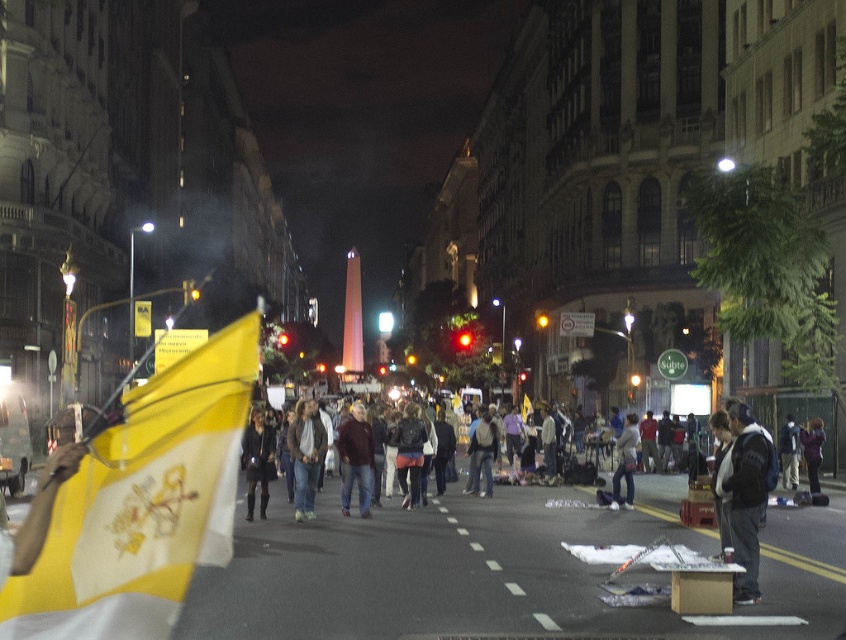
Question: Does dark blue jeans at center have a larger size compared to dark blue jacket at center?

Choices:
 (A) yes
 (B) no

Answer: (A)

Question: Does maroon sweater at center appear on the left side of dark purple jacket at center?

Choices:
 (A) no
 (B) yes

Answer: (B)

Question: Which of these objects is positioned closest to the dark blue jeans at center?

Choices:
 (A) light brown leather jacket at center
 (B) denim jacket at center
 (C) leather jacket at center
 (D) dark purple jacket at center

Answer: (C)

Question: Which of the following is the farthest from the observer?

Choices:
 (A) (39, 632)
 (B) (360, 449)
 (C) (630, 477)

Answer: (C)

Question: From the image, what is the correct spatial relationship of leather jacket at center in relation to dark purple jacket at center?

Choices:
 (A) below
 (B) above

Answer: (A)

Question: Which of these objects is positioned closest to the dark blue jeans at center?

Choices:
 (A) leather jacket at center
 (B) dark fabric coat at center
 (C) yellow fabric flag at center
 (D) maroon sweater at center

Answer: (A)